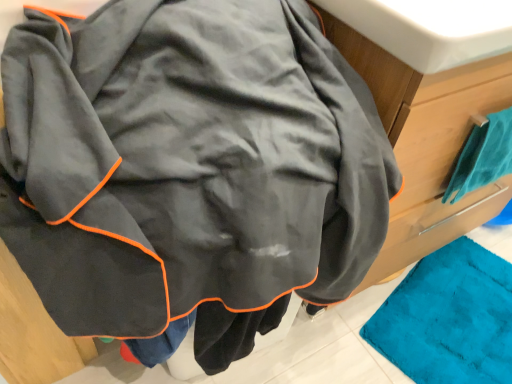
I want to click on white glossy sink at upper center, so click(430, 28).

What is the approximate height of white glossy sink at upper center?

It is 4.34 inches.

What do you see at coordinates (430, 28) in the screenshot?
I see `white glossy sink at upper center` at bounding box center [430, 28].

Locate an element on the screen. teal fabric towel at right is located at coordinates (483, 156).

What do you see at coordinates (483, 156) in the screenshot? I see `teal fabric towel at right` at bounding box center [483, 156].

Image resolution: width=512 pixels, height=384 pixels. Find the location of `white glossy sink at upper center`. white glossy sink at upper center is located at coordinates (430, 28).

Considering the positions of objects white glossy sink at upper center and teal fabric towel at right in the image provided, who is more to the right, white glossy sink at upper center or teal fabric towel at right?

From the viewer's perspective, teal fabric towel at right appears more on the right side.

Which object is closer to the camera, white glossy sink at upper center or teal fabric towel at right?

white glossy sink at upper center.

Which point is more forward, (418,56) or (506,110)?

The point (418,56) is more forward.

From the image's perspective, which one is positioned lower, white glossy sink at upper center or teal fabric towel at right?

From the image's view, teal fabric towel at right is below.

From a real-world perspective, which is physically below, white glossy sink at upper center or teal fabric towel at right?

teal fabric towel at right is physically lower.

In the scene shown: Does white glossy sink at upper center have a lesser width compared to teal fabric towel at right?

In fact, white glossy sink at upper center might be wider than teal fabric towel at right.

In terms of height, does white glossy sink at upper center look taller or shorter compared to teal fabric towel at right?

In the image, white glossy sink at upper center appears to be shorter than teal fabric towel at right.

Considering the relative sizes of white glossy sink at upper center and teal fabric towel at right in the image provided, is white glossy sink at upper center bigger than teal fabric towel at right?

Yes, white glossy sink at upper center is bigger than teal fabric towel at right.

Would you say white glossy sink at upper center contains teal fabric towel at right?

No, teal fabric towel at right is not surrounded by white glossy sink at upper center.

Is white glossy sink at upper center positioned far away from teal fabric towel at right?

No, white glossy sink at upper center is in close proximity to teal fabric towel at right.

Could you tell me if white glossy sink at upper center is turned towards teal fabric towel at right?

No, white glossy sink at upper center is not facing towards teal fabric towel at right.

Measure the distance between white glossy sink at upper center and teal fabric towel at right.

The distance of white glossy sink at upper center from teal fabric towel at right is 12.56 inches.

In the image, there is a teal fabric towel at right. Find the location of `sink above it (from the image's perspective)`. sink above it (from the image's perspective) is located at coordinates (430, 28).

Consider the image. Does teal fabric towel at right appear on the right side of white glossy sink at upper center?

Yes.

Relative to white glossy sink at upper center, is teal fabric towel at right in front or behind?

Visually, teal fabric towel at right is located behind white glossy sink at upper center.

Is point (492, 122) closer or farther from the camera than point (479, 42)?

Point (492, 122).

From the image's perspective, between teal fabric towel at right and white glossy sink at upper center, who is located below?

From the image's view, teal fabric towel at right is below.

From a real-world perspective, who is located lower, teal fabric towel at right or white glossy sink at upper center?

From a 3D spatial view, teal fabric towel at right is below.

Considering the sizes of teal fabric towel at right and white glossy sink at upper center in the image, is teal fabric towel at right wider or thinner than white glossy sink at upper center?

In the image, teal fabric towel at right appears to be more narrow than white glossy sink at upper center.

Does teal fabric towel at right have a lesser height compared to white glossy sink at upper center?

No, teal fabric towel at right is not shorter than white glossy sink at upper center.

Between teal fabric towel at right and white glossy sink at upper center, which one has larger size?

With larger size is white glossy sink at upper center.

Is teal fabric towel at right located outside white glossy sink at upper center?

Yes, teal fabric towel at right is not within white glossy sink at upper center.

Is teal fabric towel at right touching white glossy sink at upper center?

No, teal fabric towel at right is not with white glossy sink at upper center.

Does teal fabric towel at right turn towards white glossy sink at upper center?

No.

How much distance is there between teal fabric towel at right and white glossy sink at upper center?

teal fabric towel at right is 31.90 centimeters away from white glossy sink at upper center.

Where is `sink above the teal fabric towel at right (from a real-world perspective)`? Image resolution: width=512 pixels, height=384 pixels. sink above the teal fabric towel at right (from a real-world perspective) is located at coordinates (430, 28).

Locate an element on the screen. The width and height of the screenshot is (512, 384). sink in front of the teal fabric towel at right is located at coordinates (430, 28).

Image resolution: width=512 pixels, height=384 pixels. Find the location of `sink that is on the left side of teal fabric towel at right`. sink that is on the left side of teal fabric towel at right is located at coordinates (430, 28).